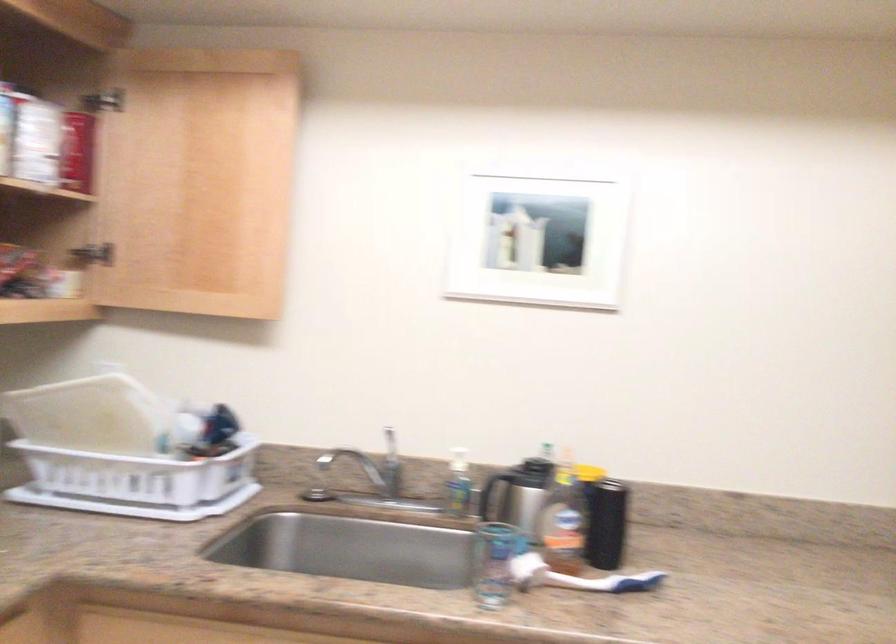
Image resolution: width=896 pixels, height=644 pixels. Describe the element at coordinates (742, 310) in the screenshot. I see `a clear drinking glass` at that location.